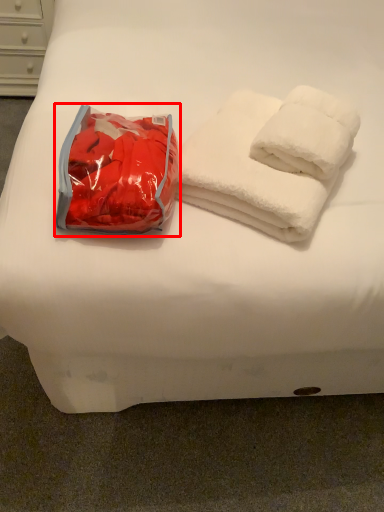
Question: From the image, what is the correct spatial relationship of bean bag chair (annotated by the red box) in relation to towel?

Choices:
 (A) right
 (B) left

Answer: (B)